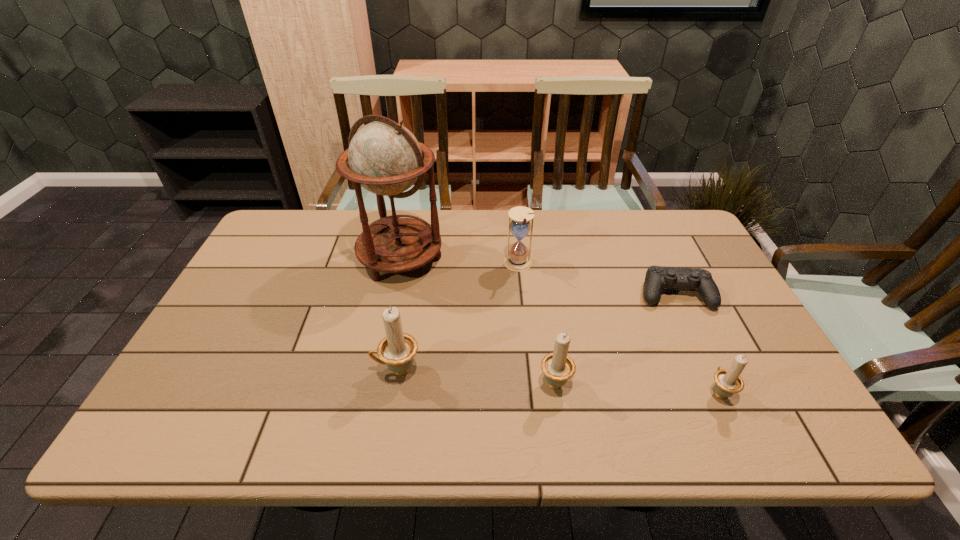
The image size is (960, 540). Find the location of `object that is at the far edge`. object that is at the far edge is located at coordinates (384, 157).

The width and height of the screenshot is (960, 540). I want to click on candle_holder that is at the right edge, so click(728, 382).

Locate an element on the screen. control situated at the right edge is located at coordinates (657, 277).

You are a GUI agent. You are given a task and a screenshot of the screen. Output one action in this format:
    pyautogui.click(x=<x>, y=<y>)
    Task: Click on the object present at the near right corner
    Image resolution: width=960 pixels, height=540 pixels.
    Given the screenshot: What is the action you would take?
    pyautogui.click(x=728, y=382)

In the image, there is a desktop. Where is `vacant space at the far edge`? Image resolution: width=960 pixels, height=540 pixels. vacant space at the far edge is located at coordinates (463, 224).

The width and height of the screenshot is (960, 540). What are the coordinates of `blank space at the near edge of the desktop` in the screenshot? It's located at (561, 396).

In the image, there is a desktop. What are the coordinates of `vacant space at the left edge` in the screenshot? It's located at (250, 297).

Identify the location of vacant space at the right edge of the desktop. (735, 302).

At what (x,y) coordinates should I click in order to perform the action: click on vacant region between the hourglass and the second shortest object. Please return your answer as a coordinate pair (x, y). The height and width of the screenshot is (540, 960). Looking at the image, I should click on (618, 328).

In order to click on free space between the second shortest object and the control in this screenshot , I will do `click(697, 343)`.